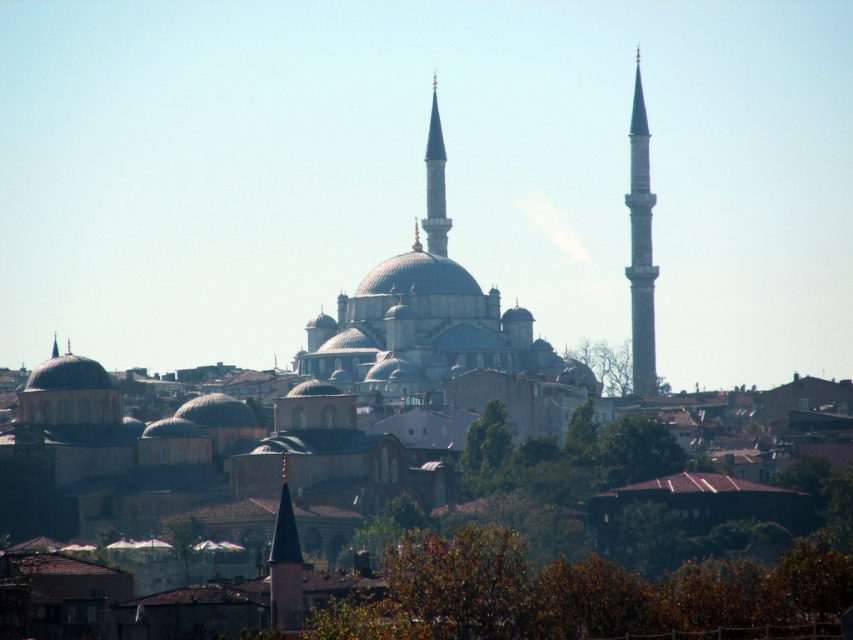
Can you confirm if smooth gray minaret at right is positioned below white marble minaret at center?

Yes, smooth gray minaret at right is below white marble minaret at center.

Which is more to the left, smooth gray minaret at right or white marble minaret at center?

Positioned to the left is white marble minaret at center.

Between point (653, 275) and point (425, 168), which one is positioned behind?

Positioned behind is point (425, 168).

At what (x,y) coordinates should I click in order to perform the action: click on smooth gray minaret at right. Please return your answer as a coordinate pair (x, y). This screenshot has width=853, height=640. Looking at the image, I should click on (640, 248).